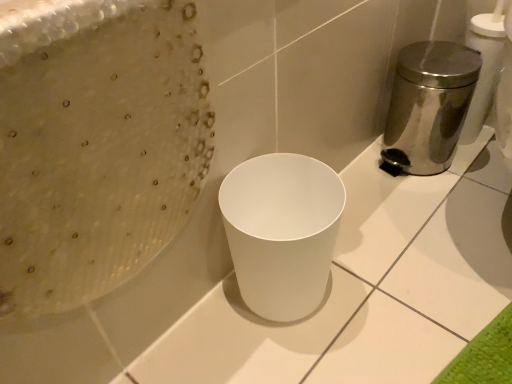
Question: Is white matte waste container at center smaller than polished stainless steel trash can at right?

Choices:
 (A) yes
 (B) no

Answer: (A)

Question: Does white matte waste container at center have a greater height compared to polished stainless steel trash can at right?

Choices:
 (A) no
 (B) yes

Answer: (A)

Question: Does white matte waste container at center have a greater width compared to polished stainless steel trash can at right?

Choices:
 (A) no
 (B) yes

Answer: (A)

Question: From the image's perspective, would you say white matte waste container at center is shown under polished stainless steel trash can at right?

Choices:
 (A) no
 (B) yes

Answer: (B)

Question: Does white matte waste container at center have a larger size compared to polished stainless steel trash can at right?

Choices:
 (A) no
 (B) yes

Answer: (A)

Question: Is white matte waste container at center positioned in front of polished stainless steel trash can at right?

Choices:
 (A) no
 (B) yes

Answer: (B)

Question: Is polished stainless steel trash can at right not near white matte waste container at center?

Choices:
 (A) yes
 (B) no

Answer: (B)

Question: Can we say polished stainless steel trash can at right lies outside white matte waste container at center?

Choices:
 (A) yes
 (B) no

Answer: (A)

Question: From a real-world perspective, is polished stainless steel trash can at right under white matte waste container at center?

Choices:
 (A) no
 (B) yes

Answer: (A)

Question: Is polished stainless steel trash can at right placed right next to white matte waste container at center?

Choices:
 (A) yes
 (B) no

Answer: (B)

Question: Is polished stainless steel trash can at right positioned with its back to white matte waste container at center?

Choices:
 (A) yes
 (B) no

Answer: (B)

Question: Could you tell me if polished stainless steel trash can at right is facing white matte waste container at center?

Choices:
 (A) no
 (B) yes

Answer: (B)

Question: Is white matte waste container at center inside the boundaries of polished stainless steel trash can at right, or outside?

Choices:
 (A) inside
 (B) outside

Answer: (B)